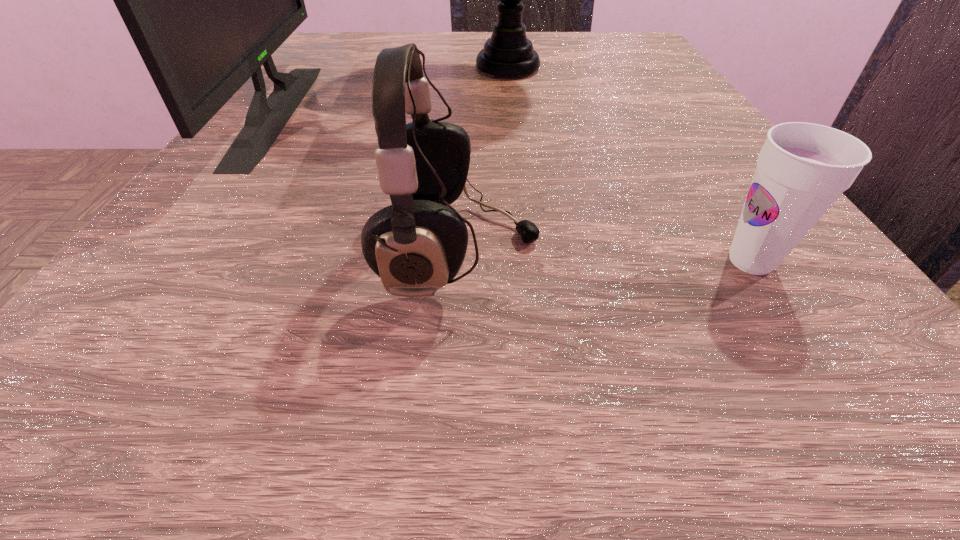
At what (x,y) coordinates should I click in order to perform the action: click on vacant space at the right edge of the desktop. Please return your answer as a coordinate pair (x, y). This screenshot has height=540, width=960. Looking at the image, I should click on click(729, 198).

You are a GUI agent. You are given a task and a screenshot of the screen. Output one action in this format:
    pyautogui.click(x=<x>, y=<y>)
    Task: Click on the vacant space at the far left corner of the desktop
    
    Given the screenshot: What is the action you would take?
    pyautogui.click(x=360, y=42)

In order to click on free space at the far right corner in this screenshot , I will do `click(566, 39)`.

Identify the location of vacant point located between the rightmost object and the third tallest object. click(606, 256).

Identify the location of vacant space that's between the shortest object and the second shortest object. Image resolution: width=960 pixels, height=540 pixels. (606, 256).

Where is `free area in between the cup and the third shortest object`? free area in between the cup and the third shortest object is located at coordinates (514, 186).

In order to click on vacant area that lies between the monitor and the rightmost object in this screenshot , I will do `click(514, 186)`.

Image resolution: width=960 pixels, height=540 pixels. In order to click on vacant space that is in between the headset and the monitor in this screenshot , I will do `click(369, 181)`.

At what (x,y) coordinates should I click in order to perform the action: click on empty location between the tallest object and the headset. Please return your answer as a coordinate pair (x, y). The width and height of the screenshot is (960, 540). Looking at the image, I should click on (485, 159).

The height and width of the screenshot is (540, 960). What are the coordinates of `vacant area between the headset and the tallest object` in the screenshot? It's located at (485, 159).